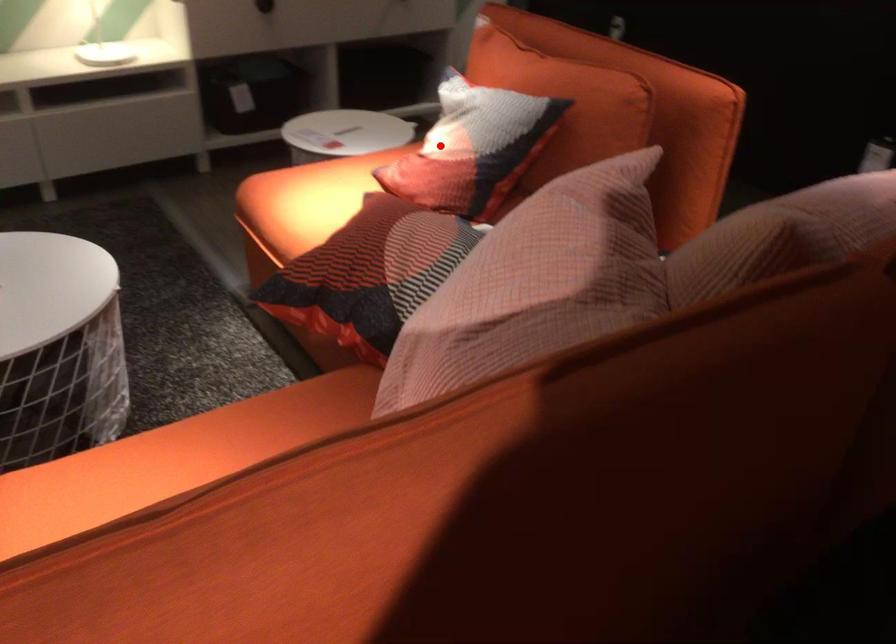
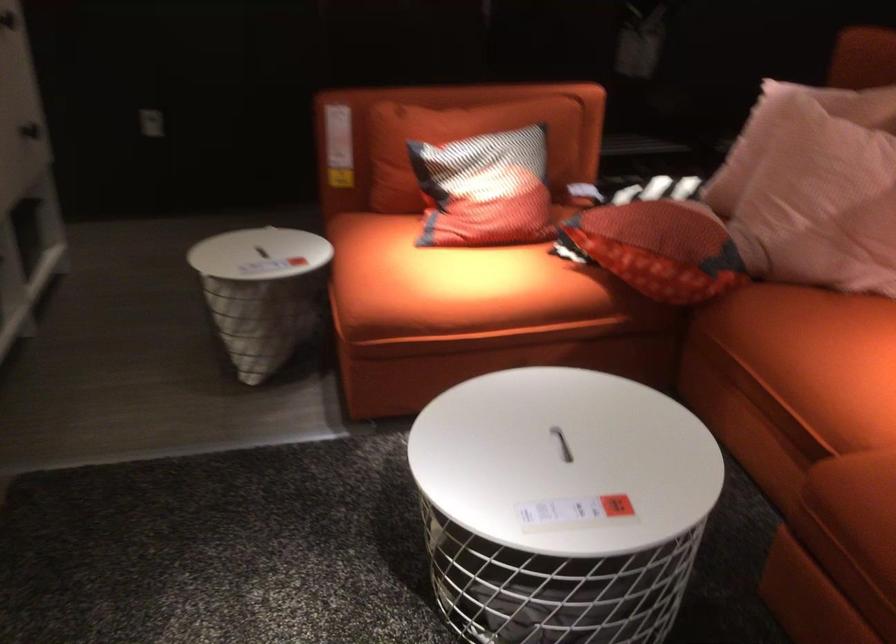
Where in the second image is the point corresponding to the highlighted location from the first image?

(485, 190)